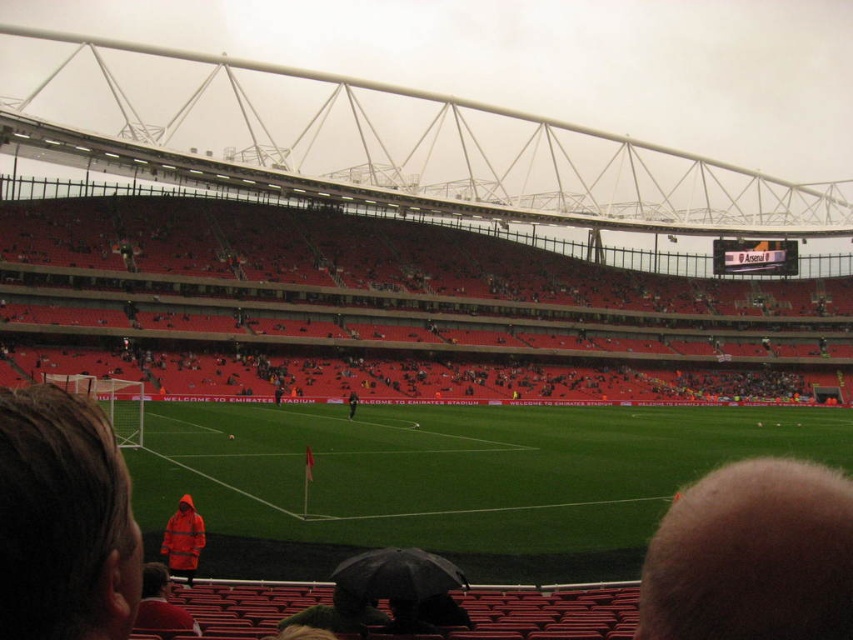
You are a drone operator trying to capture aerial footage of the football stadium. Your drone is currently hovering above the center of the field. Which direction should you move the drone to get a better view of the bald head at lower right?

To get a better view of the bald head at lower right, you should move the drone towards the lower right direction since the bald head at lower right is located at point (752, 556), which is near the lower right corner of the image.

You are a drone operator tasked with capturing aerial footage of the football stadium. Your drone is currently hovering above the point marked at coordinate (x=456, y=468). What primary surface will the drone be filming when it points its camera directly downward?

The primary surface the drone will be filming is the green grass football field at center, as the point (x=456, y=468) is where it is located.

You are a drone operator trying to capture aerial footage of the football stadium. You have two points marked in the image for your drone to fly over. The first point is at coordinates point (532, 429) and the second is at point (807, 584). Which point should you choose if you want the drone to be closer to the camera position?

Point (532, 429) is further to the viewer than point (807, 584), so you should choose point (532, 429) to be closer to the camera position.